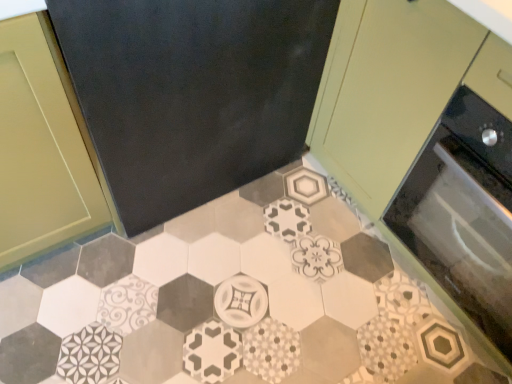
Question: Is patterned ceramic tile at center turned away from matte green cabinet at upper right?

Choices:
 (A) yes
 (B) no

Answer: (B)

Question: Is patterned ceramic tile at center thinner than matte green cabinet at upper right?

Choices:
 (A) no
 (B) yes

Answer: (A)

Question: From the image's perspective, does patterned ceramic tile at center appear higher than matte green cabinet at upper right?

Choices:
 (A) no
 (B) yes

Answer: (A)

Question: From the image's perspective, would you say patterned ceramic tile at center is shown under matte green cabinet at upper right?

Choices:
 (A) yes
 (B) no

Answer: (A)

Question: Would you say patterned ceramic tile at center is a long distance from matte green cabinet at upper right?

Choices:
 (A) no
 (B) yes

Answer: (A)

Question: Is point (475, 117) closer or farther from the camera than point (337, 57)?

Choices:
 (A) farther
 (B) closer

Answer: (B)

Question: Considering the positions of black glass oven at right and matte green cabinet at upper right in the image, is black glass oven at right wider or thinner than matte green cabinet at upper right?

Choices:
 (A) thin
 (B) wide

Answer: (A)

Question: Relative to matte green cabinet at upper right, is black glass oven at right in front or behind?

Choices:
 (A) front
 (B) behind

Answer: (B)

Question: Is black glass oven at right spatially inside matte green cabinet at upper right, or outside of it?

Choices:
 (A) outside
 (B) inside

Answer: (B)

Question: Considering the positions of patterned ceramic tile at center and black glass oven at right in the image, is patterned ceramic tile at center taller or shorter than black glass oven at right?

Choices:
 (A) short
 (B) tall

Answer: (A)

Question: From the image's perspective, relative to black glass oven at right, is patterned ceramic tile at center above or below?

Choices:
 (A) above
 (B) below

Answer: (B)

Question: From a real-world perspective, relative to black glass oven at right, is patterned ceramic tile at center vertically above or below?

Choices:
 (A) below
 (B) above

Answer: (A)

Question: In the image, is patterned ceramic tile at center positioned in front of or behind black glass oven at right?

Choices:
 (A) behind
 (B) front

Answer: (A)

Question: Considering the positions of point (340, 76) and point (237, 208), is point (340, 76) closer or farther from the camera than point (237, 208)?

Choices:
 (A) farther
 (B) closer

Answer: (B)

Question: Based on their sizes in the image, would you say matte green cabinet at upper right is bigger or smaller than patterned ceramic tile at center?

Choices:
 (A) small
 (B) big

Answer: (B)